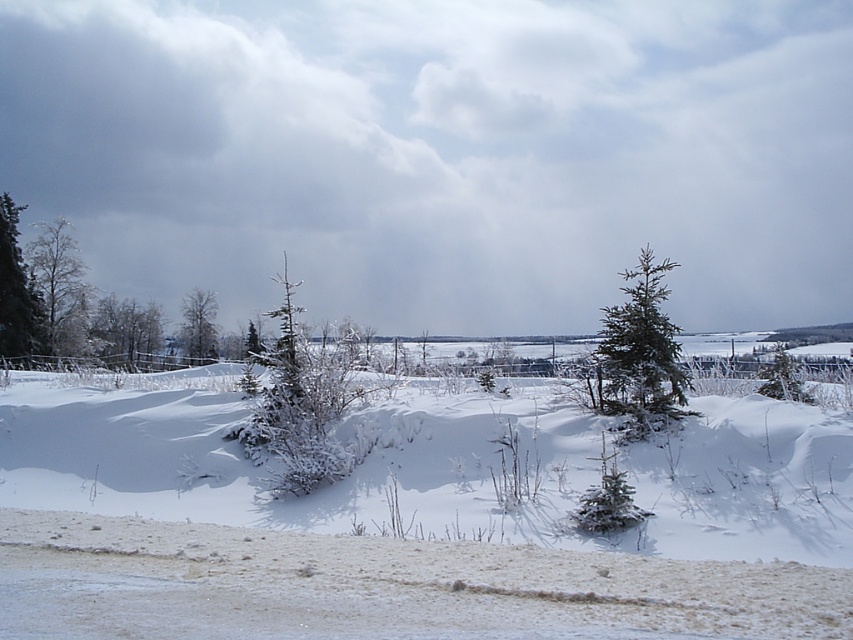
Question: Is snow-covered evergreen tree at left to the left of green matte tree at center from the viewer's perspective?

Choices:
 (A) yes
 (B) no

Answer: (A)

Question: Estimate the real-world distances between objects in this image. Which object is closer to the snow-covered evergreen at center?

Choices:
 (A) white snow at center
 (B) green matte evergreen tree at center-right
 (C) green frosted tree at left
 (D) green matte tree at center

Answer: (A)

Question: Which object appears farthest from the camera in this image?

Choices:
 (A) white snow at center
 (B) green matte evergreen tree at center-right
 (C) green frosted tree at left

Answer: (C)

Question: Is green textured evergreen tree at center smaller than green matte evergreen tree at center-right?

Choices:
 (A) no
 (B) yes

Answer: (A)

Question: Is snow-covered evergreen tree at left in front of green matte tree at center?

Choices:
 (A) yes
 (B) no

Answer: (A)

Question: Which of the following is the closest to the observer?

Choices:
 (A) (630, 410)
 (B) (241, 509)
 (C) (126, 321)

Answer: (B)